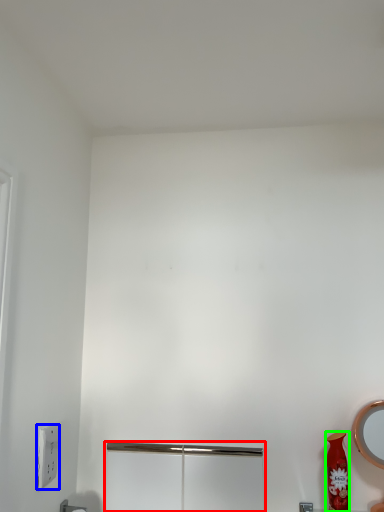
Question: Based on their relative distances, which object is nearer to screen door (highlighted by a red box)? Choose from light switch (highlighted by a blue box) and vase (highlighted by a green box).

Choices:
 (A) light switch
 (B) vase

Answer: (A)